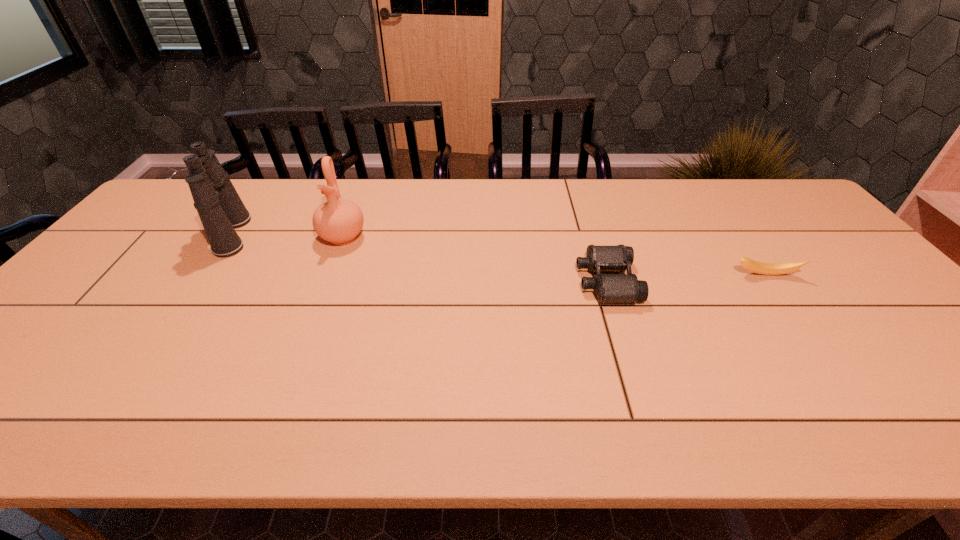
The width and height of the screenshot is (960, 540). Identify the location of the third closest object to the rightmost object. (220, 208).

Locate an element on the screen. This screenshot has width=960, height=540. free point that satisfies the following two spatial constraints: 1. at the stem of the banana; 2. through the eyepieces of the right binoculars is located at coordinates (769, 281).

Locate an element on the screen. This screenshot has width=960, height=540. vacant space that satisfies the following two spatial constraints: 1. at the stem of the rightmost object; 2. through the eyepieces of the right binoculars is located at coordinates pyautogui.click(x=769, y=281).